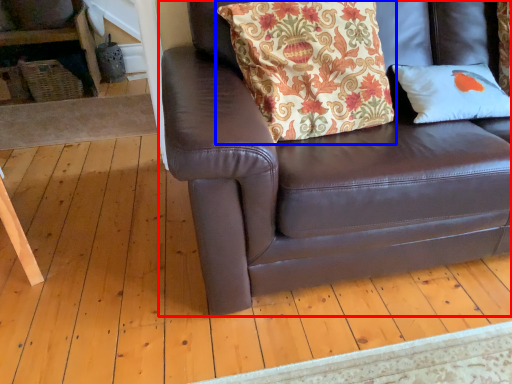
Question: Which object appears farthest to the camera in this image, studio couch (highlighted by a red box) or pillow (highlighted by a blue box)?

Choices:
 (A) studio couch
 (B) pillow

Answer: (B)